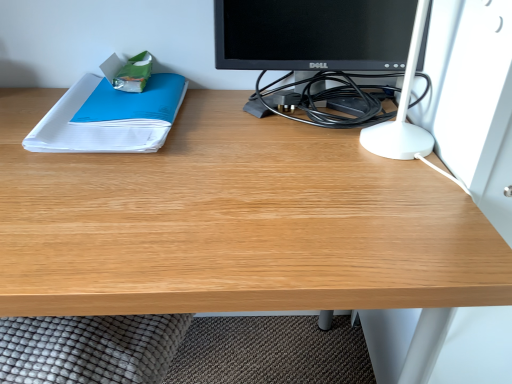
Question: Do you think black glossy monitor at upper center is within white paper at left, or outside of it?

Choices:
 (A) outside
 (B) inside

Answer: (A)

Question: Is point (335, 46) closer or farther from the camera than point (136, 122)?

Choices:
 (A) closer
 (B) farther

Answer: (B)

Question: In the image, is black glossy monitor at upper center positioned in front of or behind white paper at left?

Choices:
 (A) front
 (B) behind

Answer: (A)

Question: Considering the positions of point (36, 127) and point (347, 64), is point (36, 127) closer or farther from the camera than point (347, 64)?

Choices:
 (A) closer
 (B) farther

Answer: (A)

Question: Considering the positions of white paper at left and black glossy monitor at upper center in the image, is white paper at left bigger or smaller than black glossy monitor at upper center?

Choices:
 (A) big
 (B) small

Answer: (B)

Question: Is white paper at left taller or shorter than black glossy monitor at upper center?

Choices:
 (A) short
 (B) tall

Answer: (A)

Question: From a real-world perspective, is white paper at left positioned above or below black glossy monitor at upper center?

Choices:
 (A) below
 (B) above

Answer: (A)